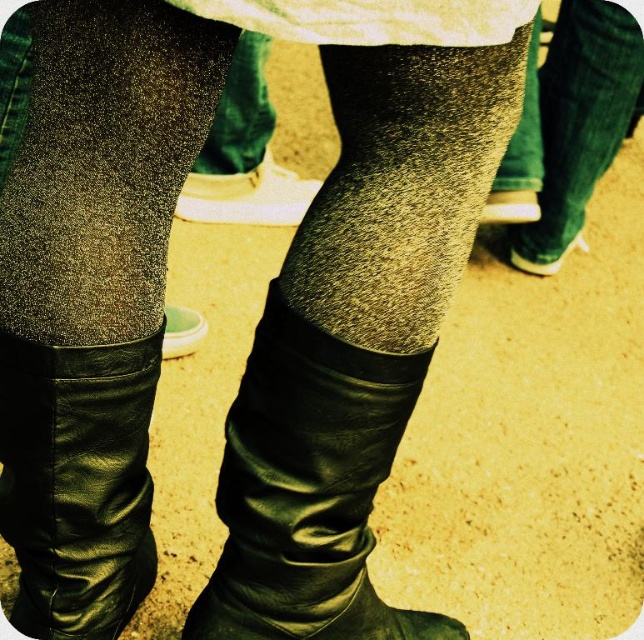
Which is more to the left, textured gray sock at center or shiny green jeans at center?

textured gray sock at center is more to the left.

Can you confirm if textured gray sock at center is positioned to the right of shiny green jeans at center?

Incorrect, textured gray sock at center is not on the right side of shiny green jeans at center.

What do you see at coordinates (401, 186) in the screenshot?
I see `textured gray sock at center` at bounding box center [401, 186].

The width and height of the screenshot is (644, 640). Identify the location of textured gray sock at center. (401, 186).

Between textured gray sock at center and green suede shoe at lower right, which one has more height?

textured gray sock at center is taller.

Does textured gray sock at center come in front of green suede shoe at lower right?

That is True.

I want to click on textured gray sock at center, so click(401, 186).

How distant is sparkly metallic tights at center from black leather boot at center?

sparkly metallic tights at center and black leather boot at center are 9.47 inches apart from each other.

Does point (149, 65) come farther from viewer compared to point (225, 547)?

That is False.

Does point (120, 120) come farther from viewer compared to point (283, 330)?

No, (120, 120) is in front of (283, 330).

You are a GUI agent. You are given a task and a screenshot of the screen. Output one action in this format:
    pyautogui.click(x=<x>, y=<y>)
    Task: Click on the sparkly metallic tights at center
    
    Given the screenshot: What is the action you would take?
    pyautogui.click(x=102, y=164)